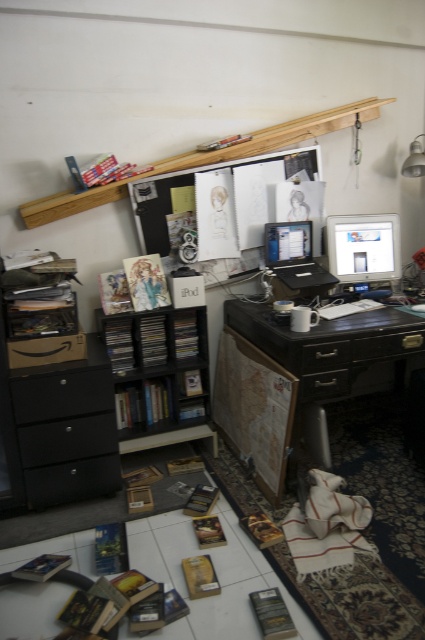
Question: Which point is closer to the camera?

Choices:
 (A) black matte drawer at lower left
 (B) black matte drawer at center
 (C) black plastic laptop at center
 (D) dark wood computer desk at center

Answer: (A)

Question: Does black matte drawer at center appear over black wood drawer at center?

Choices:
 (A) yes
 (B) no

Answer: (B)

Question: Can you confirm if black wood bookshelf at center is wider than black wood drawer at center?

Choices:
 (A) yes
 (B) no

Answer: (A)

Question: Does dark wood computer desk at center have a lesser width compared to black wood drawer at center?

Choices:
 (A) no
 (B) yes

Answer: (A)

Question: Which of the following is the farthest from the observer?

Choices:
 (A) (45, 506)
 (B) (300, 419)

Answer: (A)

Question: Among these objects, which one is nearest to the camera?

Choices:
 (A) black wood drawer at center
 (B) black matte drawer at center

Answer: (A)